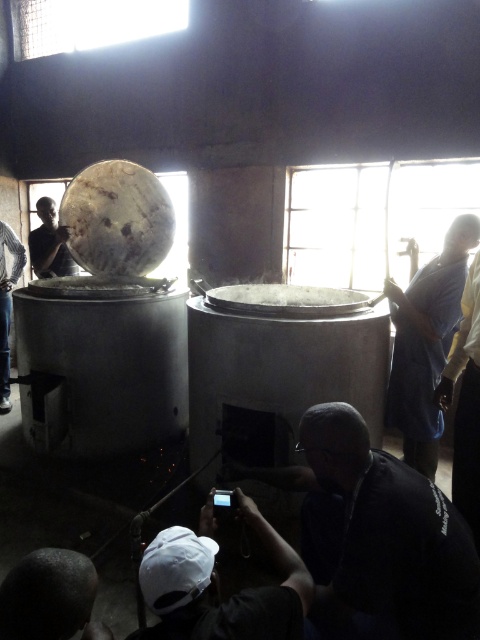
You are a maintenance worker needing to reach the white matte cap at lower center and the matte black drum at upper left. The safety protocol requires you to stay within 4 meters of each other to avoid hazards. Can you safely perform the task without moving either object?

The white matte cap at lower center is 3.94 meters from the matte black drum at upper left, so yes, you can safely perform the task as the distance is within the 4 meters safety protocol requirement.

You are an inspector checking the equipment in the room. You notice the white matte cap at lower center and the matte black drum at upper left. Which one requires more space to store due to its size?

The matte black drum at upper left requires more space to store because it is larger than the white matte cap at lower center.

Looking at this image, you are a safety inspector in the factory. You need to ensure that the blue fabric shirt at right and the dark skin head at lower left are visible to the security camera located at the center of the room. Given their sizes, which object might be more easily detected by the camera?

The blue fabric shirt at right has a larger size compared to the dark skin head at lower left, so it might be more easily detected by the security camera.